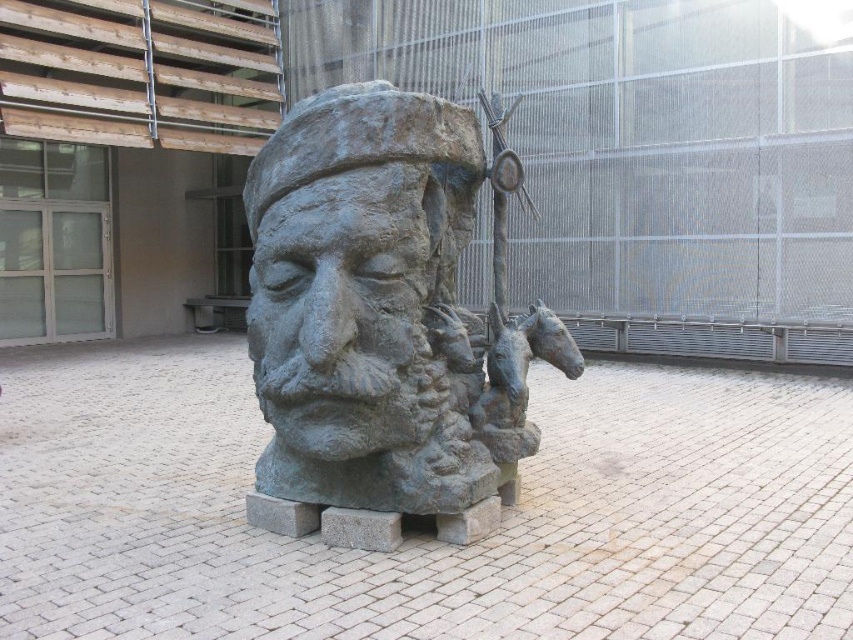
You are standing in front of the bronze statue at center and want to take a photo of the bronze sculpture at center. Which direction should you move to ensure both are in the frame?

The bronze statue at center is to the right of bronze sculpture at center. To include both in the frame, move to the left side of the bronze statue at center so that you can capture both the bronze statue at center and the bronze sculpture at center in your photo.